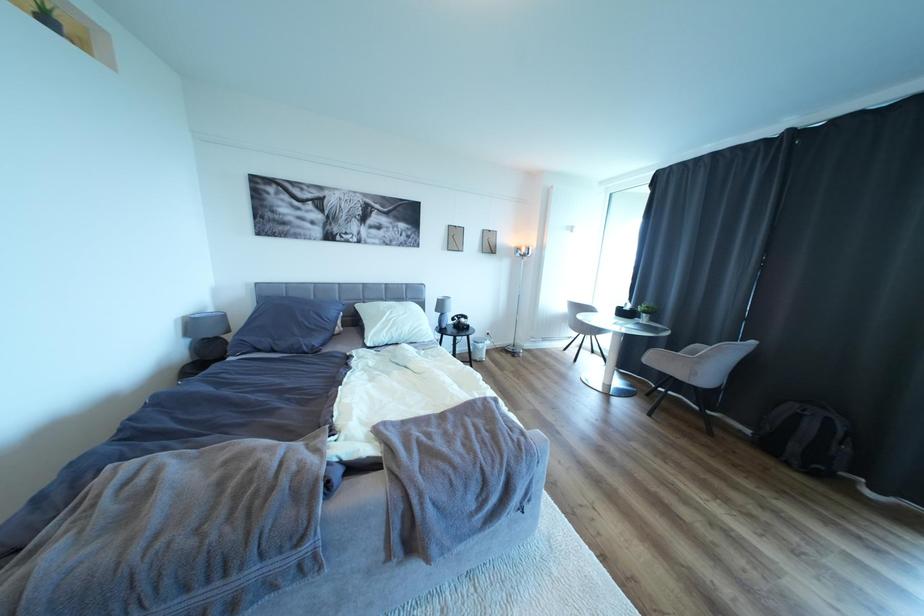
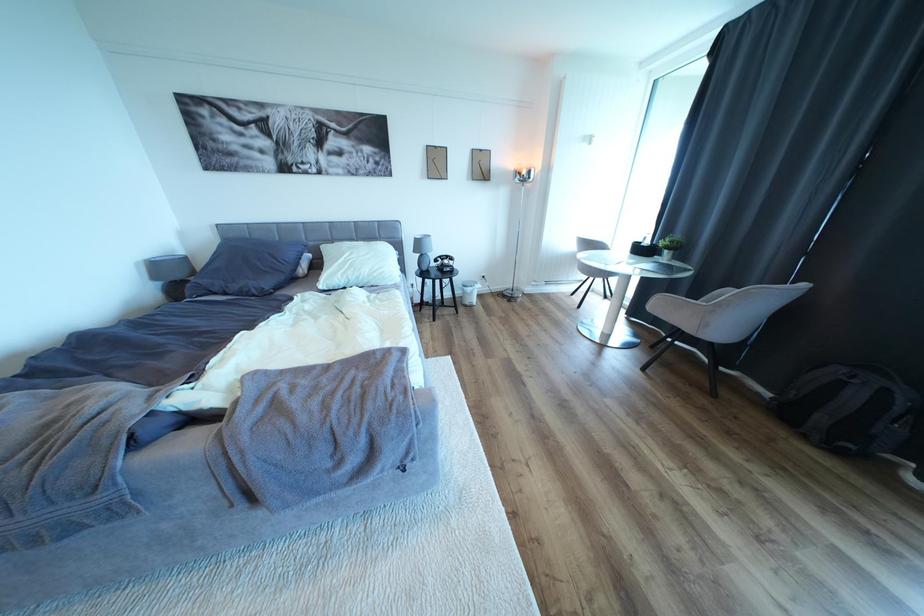
Question: How did the camera likely rotate?

Choices:
 (A) Left
 (B) Right
 (C) Up
 (D) Down

Answer: (D)